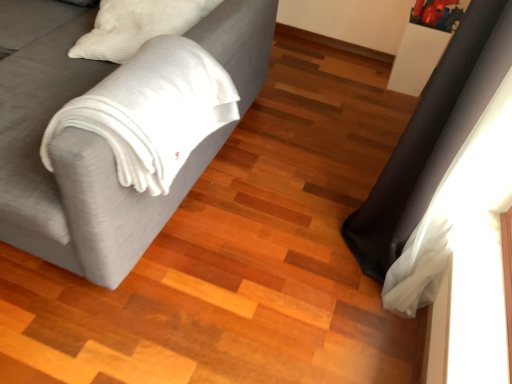
Question: Should I look upward or downward to see velvet gray couch at left?

Choices:
 (A) down
 (B) up

Answer: (B)

Question: Does velvet gray couch at left have a smaller size compared to black leather curtain at right?

Choices:
 (A) no
 (B) yes

Answer: (A)

Question: Can you confirm if velvet gray couch at left is thinner than black leather curtain at right?

Choices:
 (A) yes
 (B) no

Answer: (B)

Question: Could you tell me if velvet gray couch at left is facing black leather curtain at right?

Choices:
 (A) no
 (B) yes

Answer: (A)

Question: Considering the relative sizes of velvet gray couch at left and black leather curtain at right in the image provided, is velvet gray couch at left wider than black leather curtain at right?

Choices:
 (A) yes
 (B) no

Answer: (A)

Question: From the image's perspective, is velvet gray couch at left on top of black leather curtain at right?

Choices:
 (A) yes
 (B) no

Answer: (A)

Question: Can you confirm if velvet gray couch at left is bigger than black leather curtain at right?

Choices:
 (A) yes
 (B) no

Answer: (A)

Question: Is black leather curtain at right positioned with its back to velvet gray couch at left?

Choices:
 (A) no
 (B) yes

Answer: (A)

Question: Is black leather curtain at right smaller than velvet gray couch at left?

Choices:
 (A) no
 (B) yes

Answer: (B)

Question: Does black leather curtain at right have a lesser width compared to velvet gray couch at left?

Choices:
 (A) no
 (B) yes

Answer: (B)

Question: Is black leather curtain at right wider than velvet gray couch at left?

Choices:
 (A) yes
 (B) no

Answer: (B)

Question: Does black leather curtain at right lie in front of velvet gray couch at left?

Choices:
 (A) yes
 (B) no

Answer: (B)

Question: From a real-world perspective, is black leather curtain at right located beneath velvet gray couch at left?

Choices:
 (A) no
 (B) yes

Answer: (A)

Question: From a real-world perspective, is black leather curtain at right positioned above or below velvet gray couch at left?

Choices:
 (A) below
 (B) above

Answer: (B)